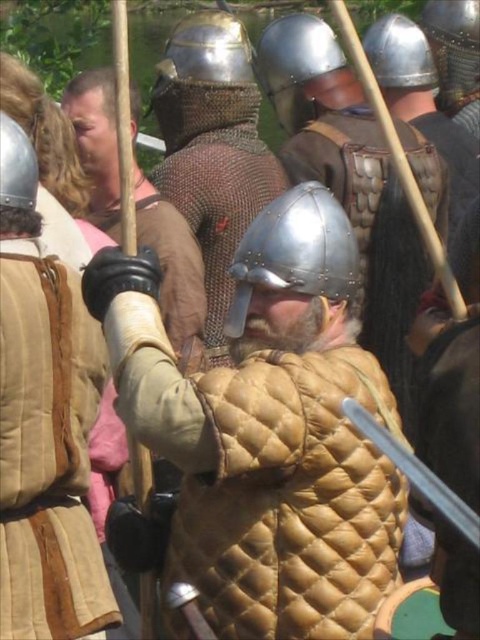
Question: Can you confirm if matte gold quilted armor at center is wider than metallic silver sword at center?

Choices:
 (A) yes
 (B) no

Answer: (A)

Question: Which of the following is the closest to the observer?

Choices:
 (A) (12, 131)
 (B) (414, 458)

Answer: (B)

Question: Does shiny silver helmet at center lie behind shiny silver helmet at upper left?

Choices:
 (A) no
 (B) yes

Answer: (B)

Question: Which object is the closest to the shiny silver helmet at center?

Choices:
 (A) matte gold quilted armor at center
 (B) shiny silver helmet at upper left

Answer: (B)

Question: Which point is farther to the camera?

Choices:
 (A) (259, 54)
 (B) (474, 22)
 (C) (70, 364)
 (D) (422, 465)

Answer: (B)

Question: Is metallic silver sword at center behind metallic silver helmet at upper center?

Choices:
 (A) no
 (B) yes

Answer: (A)